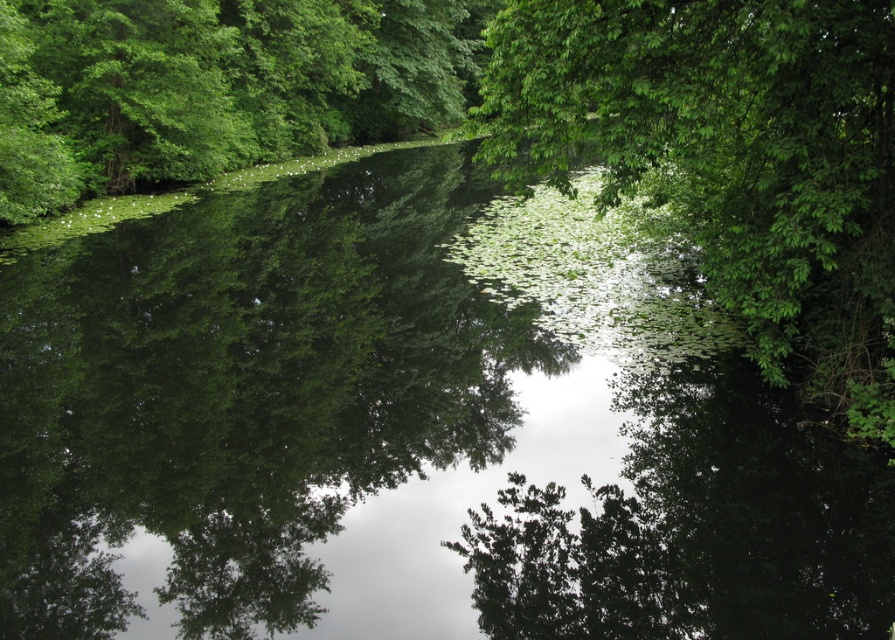
You are standing at the point labeled point at (882, 147). You want to walk straight towards the opposite bank of the water. How far will you have to walk to reach the bank?

The distance between the point labeled point at (882, 147) and the opposite bank is 7.13 meters, so you will have to walk 7.13 meters to reach the bank.

You are a hiker who wants to cross the water using a 5 meter long plank. You see the green leafy tree at upper center and the green leafy tree at left. Can you place the plank between them to cross?

The green leafy tree at upper center and green leafy tree at left are 7.62 meters apart from each other. Since the plank is only 5 meters long, it won t reach between them. You cannot cross using this plank.